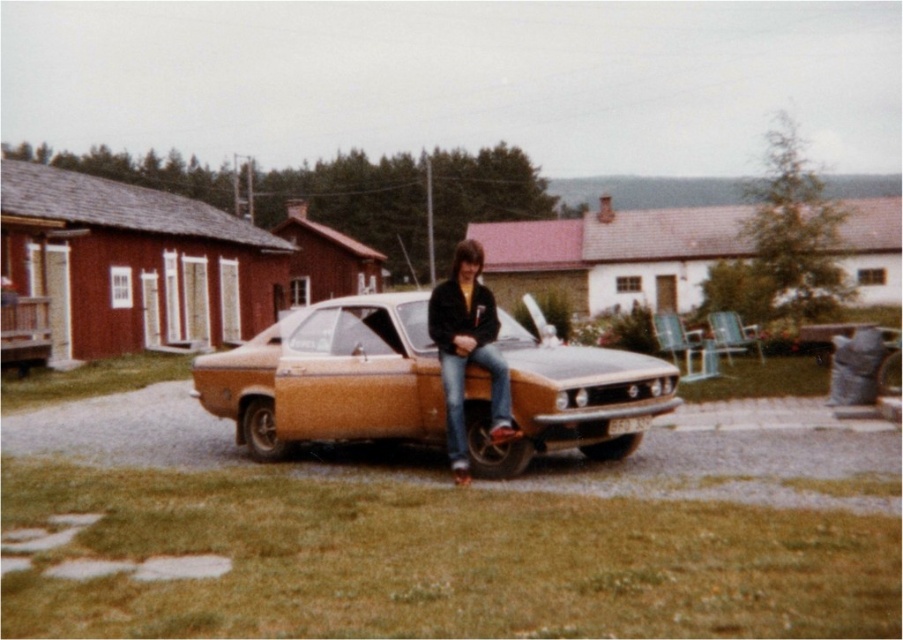
Question: Is matte orange car at center smaller than jeans at center?

Choices:
 (A) no
 (B) yes

Answer: (A)

Question: Which point is closer to the camera taking this photo?

Choices:
 (A) (383, 406)
 (B) (440, 317)

Answer: (B)

Question: Among these points, which one is nearest to the camera?

Choices:
 (A) (466, 442)
 (B) (360, 374)

Answer: (A)

Question: Is matte orange car at center in front of jeans at center?

Choices:
 (A) yes
 (B) no

Answer: (A)

Question: Can you confirm if matte orange car at center is bigger than jeans at center?

Choices:
 (A) yes
 (B) no

Answer: (A)